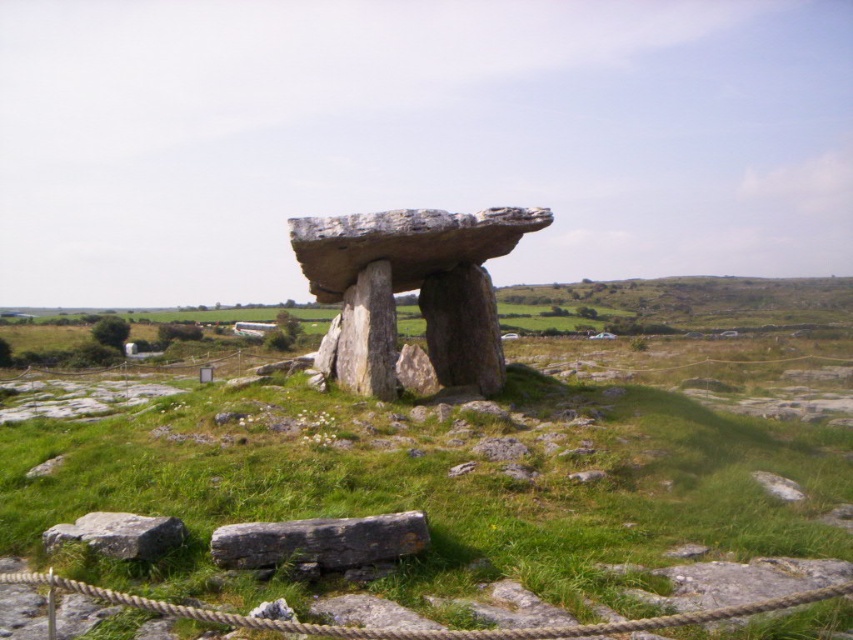
You are standing at the edge of the dolmen site and notice the green grassy at center and the roperough at lower center. From your position, which object is positioned to the left side?

The green grassy at center is to the left of the roperough at lower center.